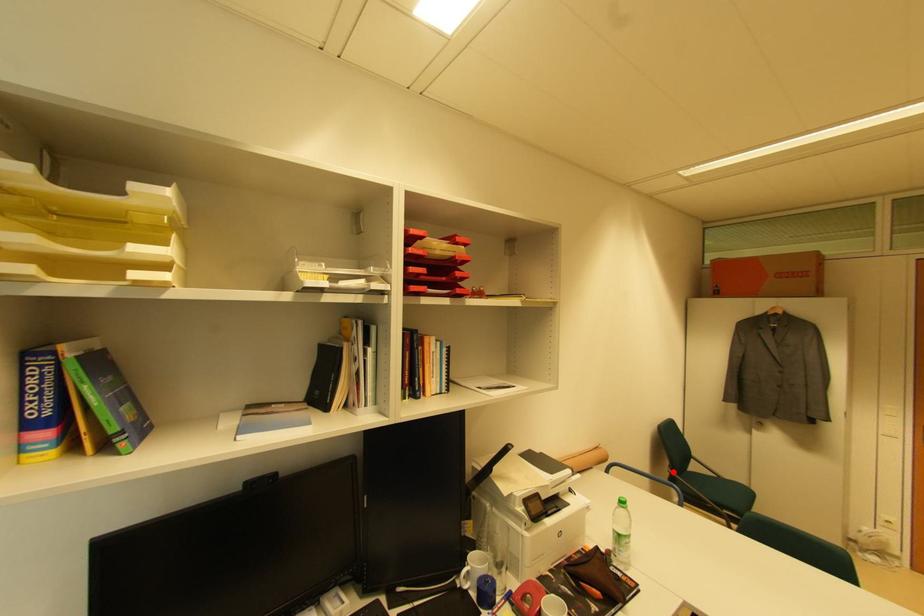
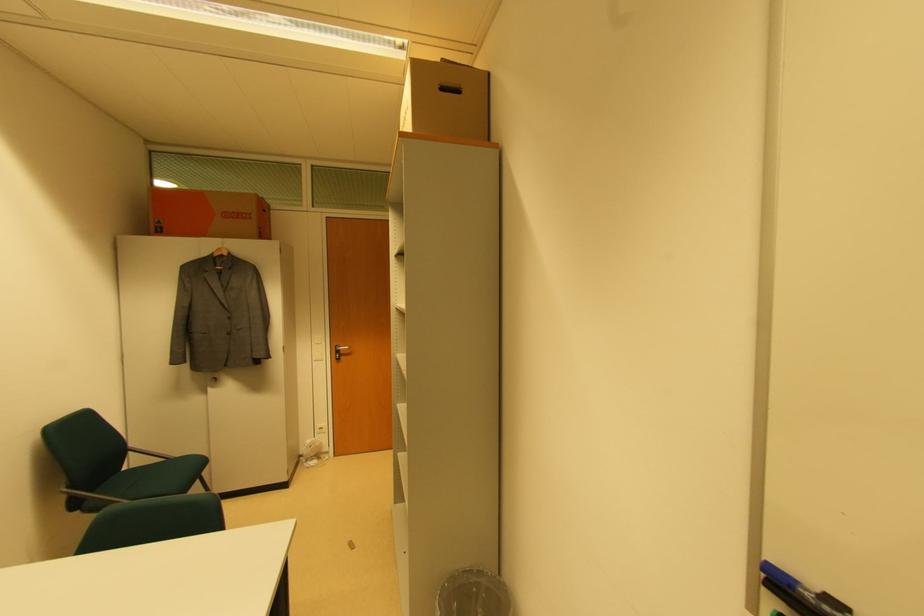
Where in the second image is the point corresponding to the highlighted location from the first image?

(69, 488)